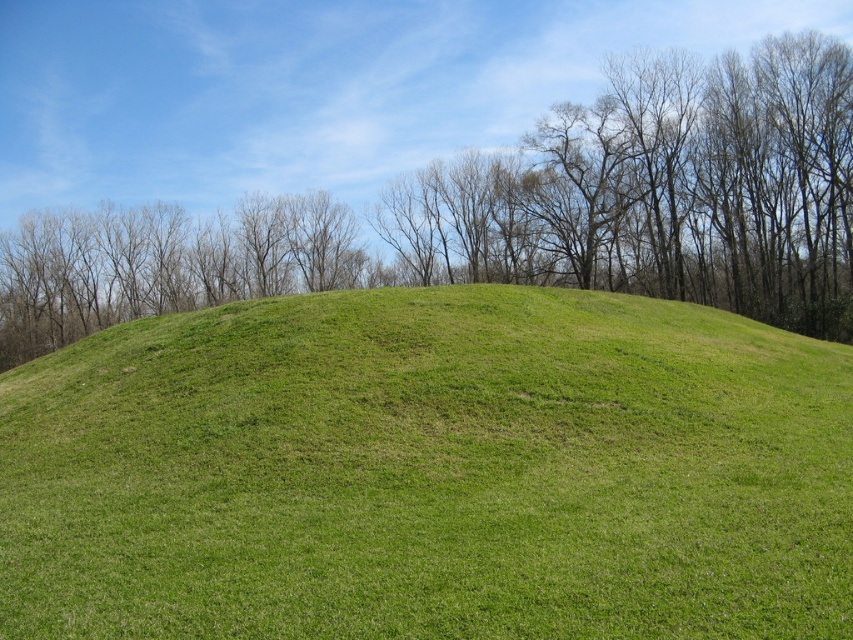
You are standing at the point labeled as point (428, 472) in the image. Looking around, what is the immediate terrain you are standing on?

You are standing on the green grassy hill at center, as the point (428, 472) represents the green grassy hill at center.